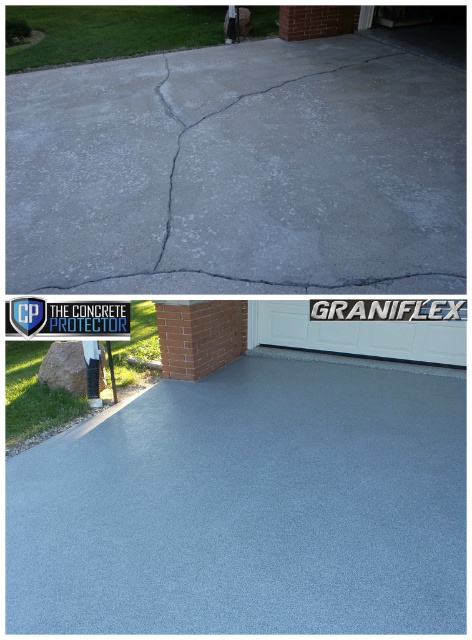
Question: Which of these objects is positioned closest to the smooth gray concrete at center?

Choices:
 (A) gray concrete at upper center
 (B) gray concrete crack at upper center
 (C) white plastic sign at upper center

Answer: (C)

Question: Is gray concrete at upper center to the left of gray concrete crack at upper center from the viewer's perspective?

Choices:
 (A) no
 (B) yes

Answer: (A)

Question: Is smooth gray concrete at center below gray concrete crack at upper center?

Choices:
 (A) no
 (B) yes

Answer: (B)

Question: Is smooth gray concrete at center closer to camera compared to gray concrete at upper center?

Choices:
 (A) yes
 (B) no

Answer: (A)

Question: Which object appears closest to the camera in this image?

Choices:
 (A) smooth gray concrete at center
 (B) white plastic sign at upper center
 (C) gray concrete crack at upper center
 (D) gray concrete at upper center

Answer: (A)

Question: Which of the following is the closest to the observer?

Choices:
 (A) white plastic sign at upper center
 (B) gray concrete crack at upper center
 (C) gray concrete at upper center

Answer: (B)